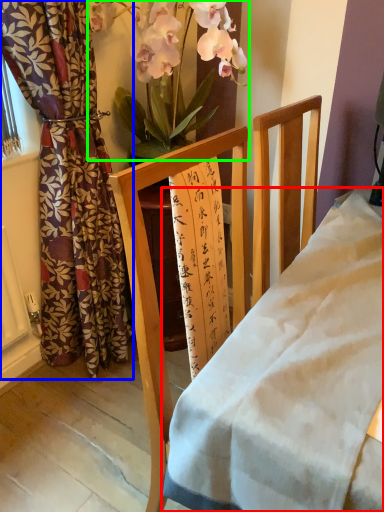
Question: Which is farther away from desk (highlighted by a red box)? curtain (highlighted by a blue box) or floral arrangement (highlighted by a green box)?

Choices:
 (A) curtain
 (B) floral arrangement

Answer: (B)